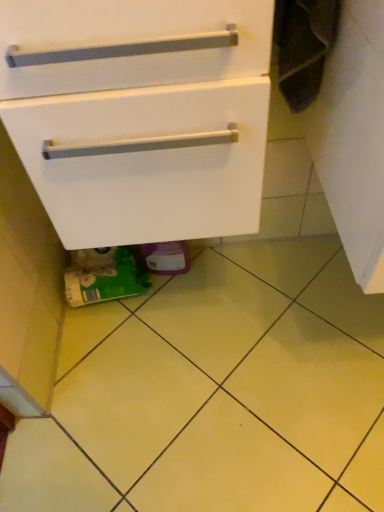
Question: Considering the relative positions of white matte cabinet at center and yellow matte tile at lower center in the image provided, is white matte cabinet at center to the left or to the right of yellow matte tile at lower center?

Choices:
 (A) left
 (B) right

Answer: (A)

Question: In the image, is white matte cabinet at center positioned in front of or behind yellow matte tile at lower center?

Choices:
 (A) behind
 (B) front

Answer: (B)

Question: Considering the positions of white matte cabinet at center and yellow matte tile at lower center in the image, is white matte cabinet at center bigger or smaller than yellow matte tile at lower center?

Choices:
 (A) small
 (B) big

Answer: (B)

Question: From a real-world perspective, is yellow matte tile at lower center positioned above or below white matte cabinet at center?

Choices:
 (A) below
 (B) above

Answer: (A)

Question: Looking at their shapes, would you say yellow matte tile at lower center is wider or thinner than white matte cabinet at center?

Choices:
 (A) thin
 (B) wide

Answer: (B)

Question: Is yellow matte tile at lower center in front of or behind white matte cabinet at center in the image?

Choices:
 (A) front
 (B) behind

Answer: (B)

Question: In terms of size, does yellow matte tile at lower center appear bigger or smaller than white matte cabinet at center?

Choices:
 (A) small
 (B) big

Answer: (A)